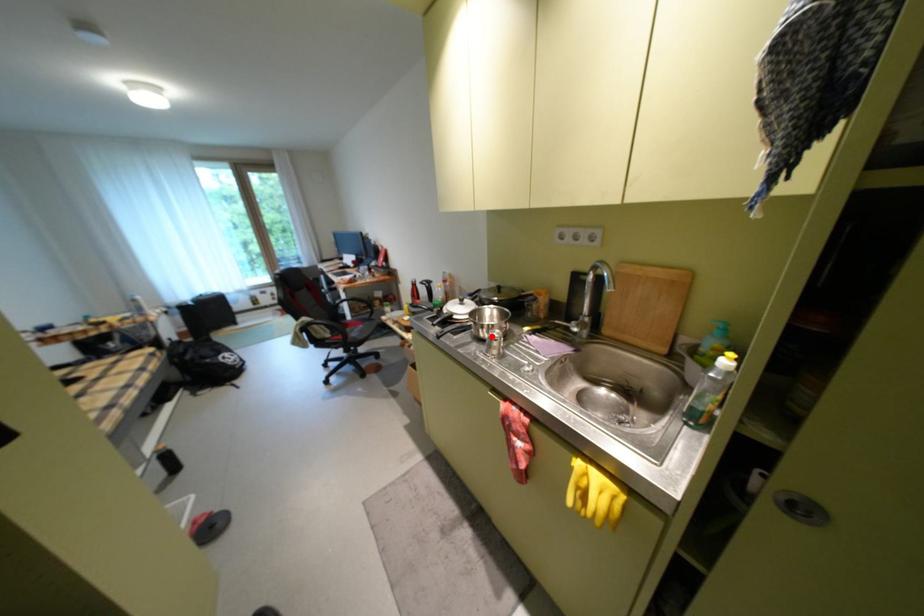
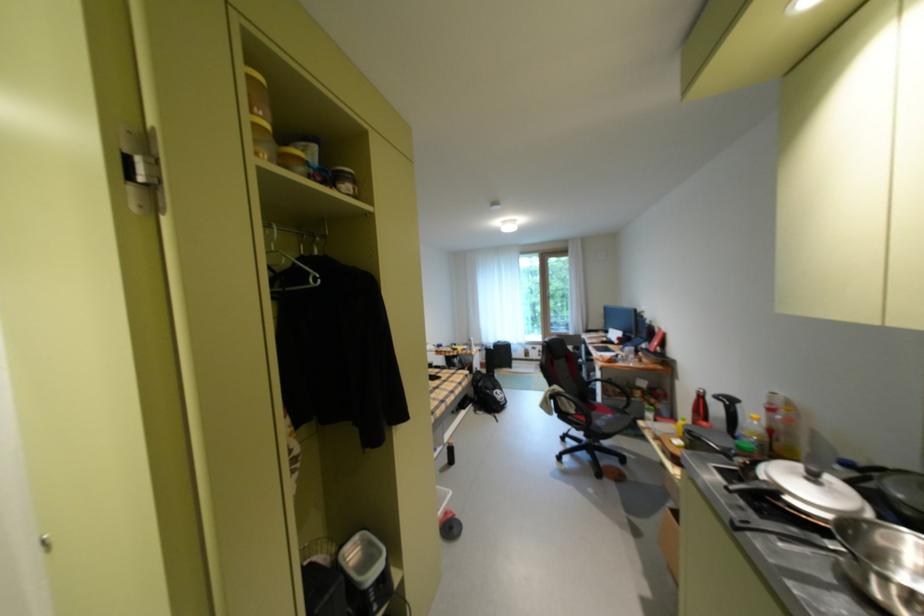
Find the pixel in the second image that matches the highlighted location in the first image.

(888, 594)